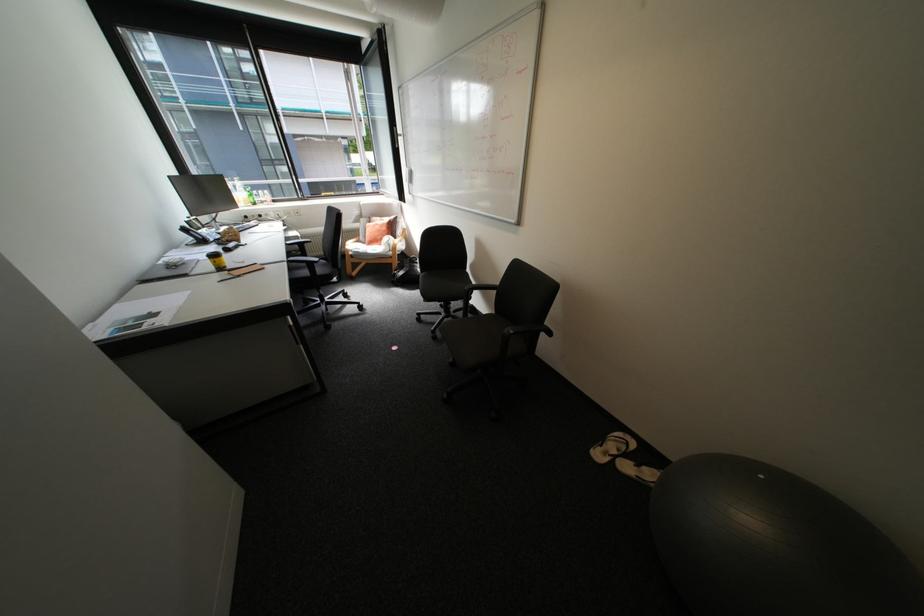
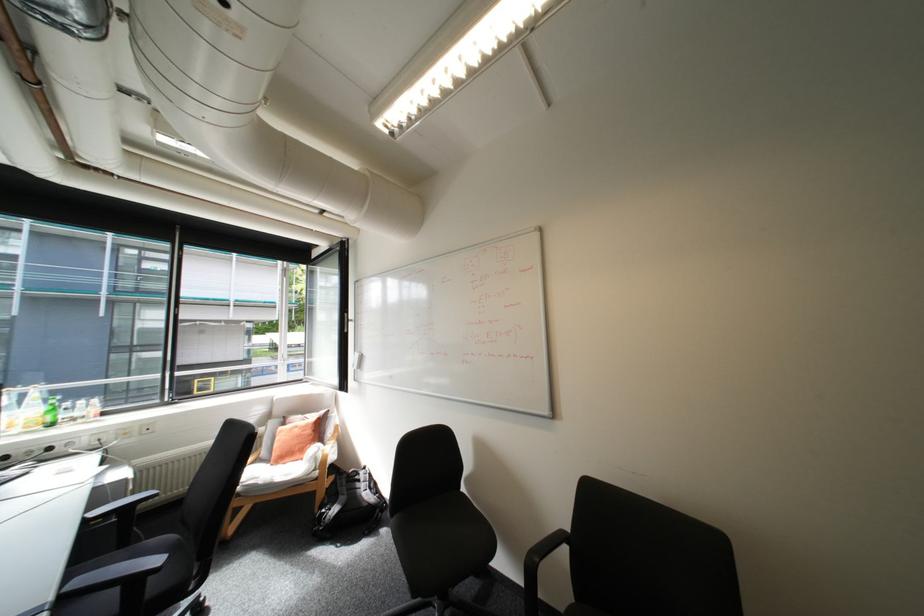
Where in the second image is the point corresponding to the point at 386,225 from the first image?

(307, 429)